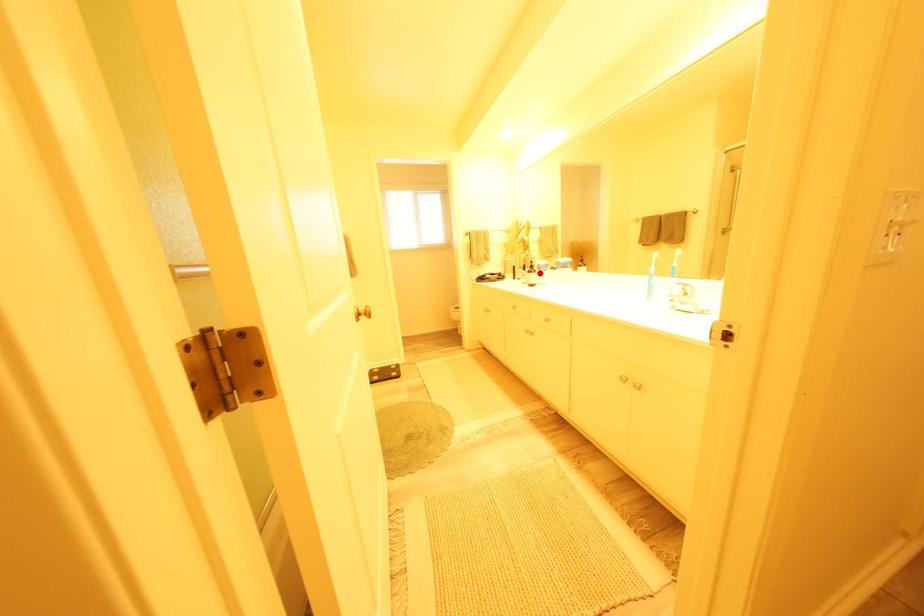
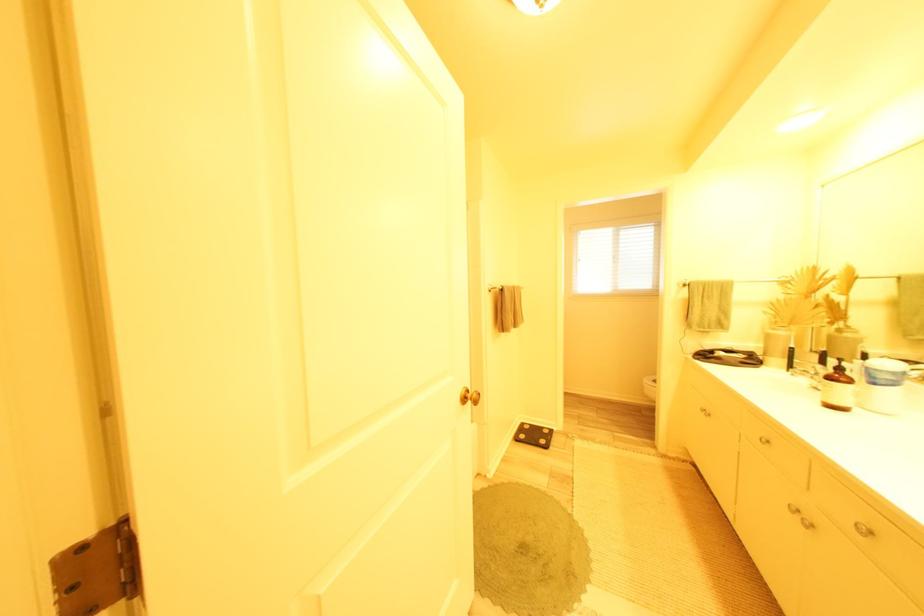
Question: I am providing you with two images of the same scene from different viewpoints. A red point is marked on the first image. Is the red point's position out of view in image 2?

Choices:
 (A) Yes
 (B) No

Answer: (B)